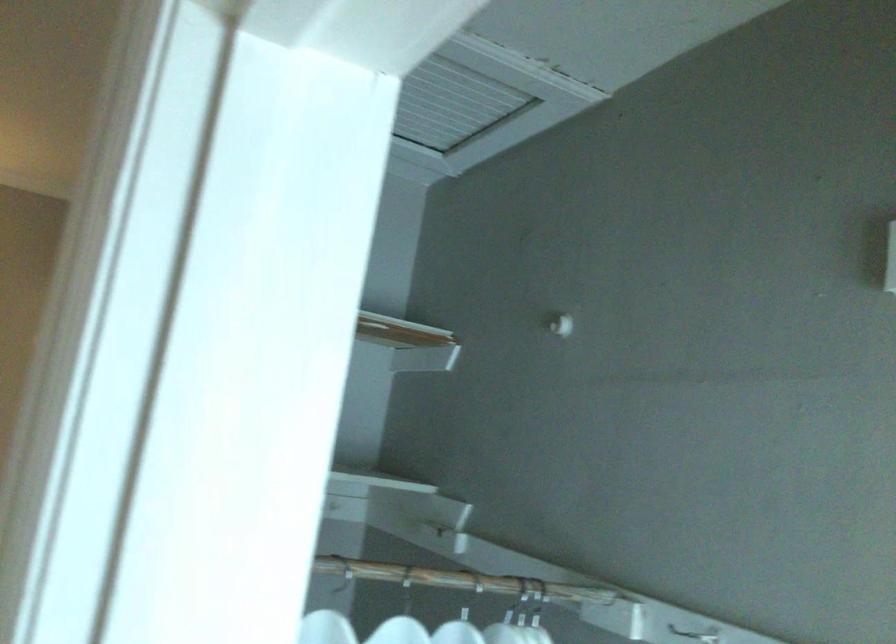
Find where to hang the closet rod. Please return your answer as a coordinate pair (x, y).

(460, 580)